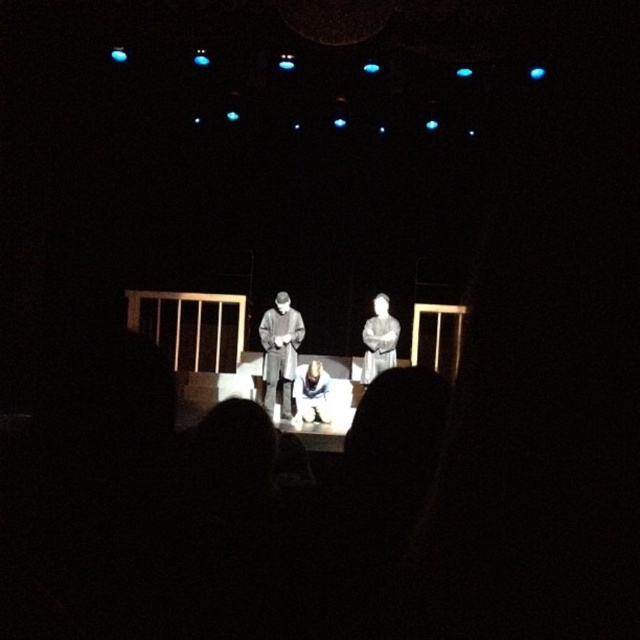
You are an audience member sitting in the front row of the theater. You notice two items at the center of the stage, the gray fabric coat at center and the white fabric at center. Which one is closer to you?

The gray fabric coat at center is closer to you because it is further to the viewer than the white fabric at center.

You are an actor standing at the center of the stage. You need to move to the point marked as point (280, 352). Which object should you walk towards?

You should walk towards the gray fabric coat at center because the point (280, 352) is located on it.